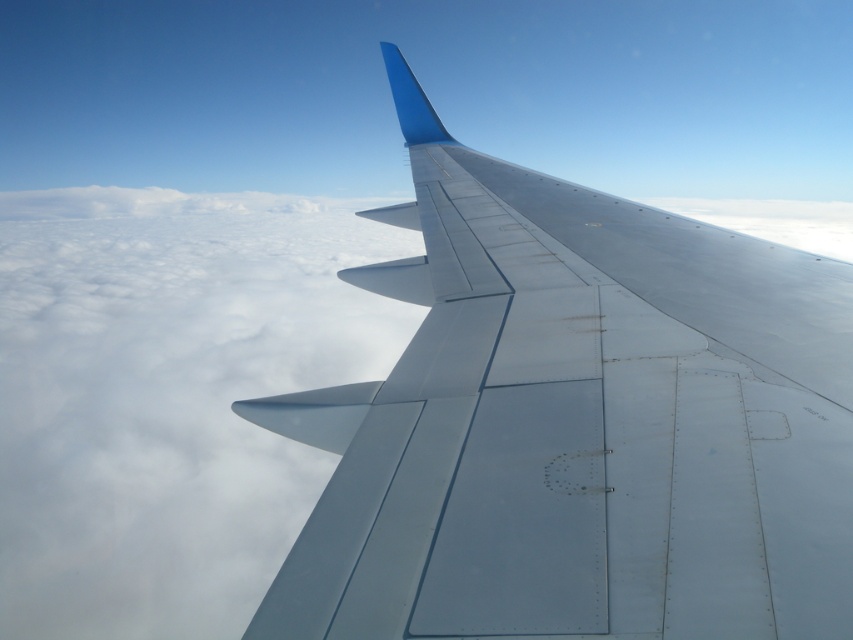
Between metallic gray wing at center and white fluffy cloud at upper left, which one is positioned lower?

Answer: metallic gray wing at center is below.

Which is behind, point (799, 522) or point (238, 317)?

The point (238, 317) is behind.

Is point (627, 560) behind point (218, 618)?

That is False.

Image resolution: width=853 pixels, height=640 pixels. What are the coordinates of `metallic gray wing at center` in the screenshot? It's located at (577, 424).